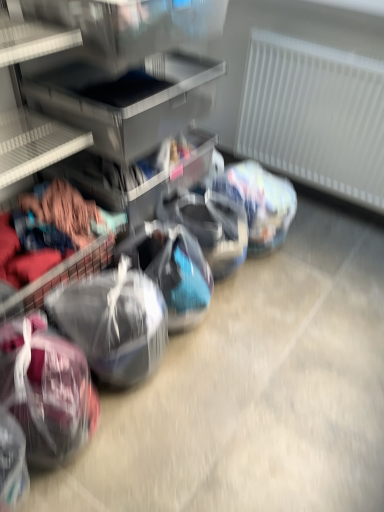
Find the location of a particular element. maroon fabric sack at lower left, which appears as the first sack when viewed from the left is located at coordinates (46, 389).

Where is `the 2nd sack to the left when counting from the white textured radiator at right`? the 2nd sack to the left when counting from the white textured radiator at right is located at coordinates (46, 389).

Which object is wider, white textured radiator at right or maroon fabric sack at lower left, the second sack when ordered from right to left?

With larger width is maroon fabric sack at lower left, the second sack when ordered from right to left.

How far apart are white textured radiator at right and maroon fabric sack at lower left, the second sack when ordered from right to left?

white textured radiator at right and maroon fabric sack at lower left, the second sack when ordered from right to left, are 1.52 meters apart.

Is white textured radiator at right oriented towards maroon fabric sack at lower left, the second sack when ordered from right to left?

Yes, white textured radiator at right is oriented towards maroon fabric sack at lower left, the second sack when ordered from right to left.

Are maroon fabric sack at lower left, the second sack when ordered from right to left, and translucent plastic sack at lower left, the 1th sack positioned from the right, located far from each other?

They are positioned close to each other.

From a real-world perspective, is maroon fabric sack at lower left, which appears as the first sack when viewed from the left, positioned above or below translucent plastic sack at lower left, the 1th sack positioned from the right?

From a real-world perspective, maroon fabric sack at lower left, which appears as the first sack when viewed from the left, is physically below translucent plastic sack at lower left, the 1th sack positioned from the right.

Considering the points (50, 360) and (161, 331), which point is behind, point (50, 360) or point (161, 331)?

The point (161, 331) is farther from the camera.

Based on the photo, would you say maroon fabric sack at lower left, the second sack when ordered from right to left, is outside translucent plastic sack at lower left, the 1th sack positioned from the right?

Yes.

Which object is wider, translucent plastic sack at lower left, the 1th sack positioned from the right, or maroon fabric sack at lower left, the second sack when ordered from right to left?

translucent plastic sack at lower left, the 1th sack positioned from the right.

Is translucent plastic sack at lower left, which is counted as the 2th sack, starting from the left, inside the boundaries of maroon fabric sack at lower left, which appears as the first sack when viewed from the left, or outside?

translucent plastic sack at lower left, which is counted as the 2th sack, starting from the left, exists outside the volume of maroon fabric sack at lower left, which appears as the first sack when viewed from the left.

Where is `sack that is under the translucent plastic sack at lower left, which is counted as the 2th sack, starting from the left (from a real-world perspective)`? The width and height of the screenshot is (384, 512). sack that is under the translucent plastic sack at lower left, which is counted as the 2th sack, starting from the left (from a real-world perspective) is located at coordinates (46, 389).

Choose the correct answer: Is white textured radiator at right inside translucent plastic sack at lower left, the 1th sack positioned from the right, or outside it?

white textured radiator at right is outside translucent plastic sack at lower left, the 1th sack positioned from the right.

Locate an element on the screen. radiator above the translucent plastic sack at lower left, the 1th sack positioned from the right (from the image's perspective) is located at coordinates (314, 116).

Between white textured radiator at right and translucent plastic sack at lower left, which is counted as the 2th sack, starting from the left, which one has more height?

With more height is white textured radiator at right.

Who is bigger, white textured radiator at right or translucent plastic sack at lower left, the 1th sack positioned from the right?

Bigger between the two is white textured radiator at right.

Visually, is maroon fabric sack at lower left, the second sack when ordered from right to left, positioned to the left or to the right of white textured radiator at right?

maroon fabric sack at lower left, the second sack when ordered from right to left, is positioned on white textured radiator at right's left side.

Does point (13, 398) come closer to viewer compared to point (275, 113)?

Yes, it is.

Is white textured radiator at right at the back of maroon fabric sack at lower left, which appears as the first sack when viewed from the left?

No.

From the image's perspective, is maroon fabric sack at lower left, which appears as the first sack when viewed from the left, above white textured radiator at right?

No, from the image's perspective, maroon fabric sack at lower left, which appears as the first sack when viewed from the left, is not over white textured radiator at right.

Can you tell me how much translucent plastic sack at lower left, which is counted as the 2th sack, starting from the left, and white textured radiator at right differ in facing direction?

translucent plastic sack at lower left, which is counted as the 2th sack, starting from the left, and white textured radiator at right are facing 89.6 degrees away from each other.

Based on their sizes in the image, would you say translucent plastic sack at lower left, the 1th sack positioned from the right, is bigger or smaller than white textured radiator at right?

Clearly, translucent plastic sack at lower left, the 1th sack positioned from the right, is smaller in size than white textured radiator at right.

From the image's perspective, is translucent plastic sack at lower left, which is counted as the 2th sack, starting from the left, located above or below white textured radiator at right?

Clearly, from the image's perspective, translucent plastic sack at lower left, which is counted as the 2th sack, starting from the left, is below white textured radiator at right.

Is translucent plastic sack at lower left, which is counted as the 2th sack, starting from the left, in contact with white textured radiator at right?

There is a gap between translucent plastic sack at lower left, which is counted as the 2th sack, starting from the left, and white textured radiator at right.

The image size is (384, 512). Identify the location of the 2nd sack to the left when counting from the white textured radiator at right. (46, 389).

This screenshot has height=512, width=384. In order to click on sack behind the maroon fabric sack at lower left, the second sack when ordered from right to left in this screenshot , I will do `click(114, 322)`.

Estimate the real-world distances between objects in this image. Which object is closer to maroon fabric sack at lower left, which appears as the first sack when viewed from the left, white textured radiator at right or translucent plastic sack at lower left, the 1th sack positioned from the right?

translucent plastic sack at lower left, the 1th sack positioned from the right, is closer to maroon fabric sack at lower left, which appears as the first sack when viewed from the left.

When comparing their distances from white textured radiator at right, does translucent plastic sack at lower left, the 1th sack positioned from the right, or maroon fabric sack at lower left, the second sack when ordered from right to left, seem closer?

translucent plastic sack at lower left, the 1th sack positioned from the right, is positioned closer to the anchor white textured radiator at right.

Considering their positions, is maroon fabric sack at lower left, the second sack when ordered from right to left, positioned closer to white textured radiator at right than translucent plastic sack at lower left, the 1th sack positioned from the right?

translucent plastic sack at lower left, the 1th sack positioned from the right, lies closer to white textured radiator at right than the other object.

Based on their spatial positions, is translucent plastic sack at lower left, the 1th sack positioned from the right, or white textured radiator at right further from maroon fabric sack at lower left, the second sack when ordered from right to left?

white textured radiator at right is positioned further to the anchor maroon fabric sack at lower left, the second sack when ordered from right to left.

Based on the photo, considering their positions, is maroon fabric sack at lower left, the second sack when ordered from right to left, positioned further to translucent plastic sack at lower left, which is counted as the 2th sack, starting from the left, than white textured radiator at right?

white textured radiator at right lies further to translucent plastic sack at lower left, which is counted as the 2th sack, starting from the left, than the other object.

Looking at the image, which one is located further to translucent plastic sack at lower left, which is counted as the 2th sack, starting from the left, white textured radiator at right or maroon fabric sack at lower left, the second sack when ordered from right to left?

Based on the image, white textured radiator at right appears to be further to translucent plastic sack at lower left, which is counted as the 2th sack, starting from the left.

The height and width of the screenshot is (512, 384). In order to click on sack between maroon fabric sack at lower left, the second sack when ordered from right to left, and white textured radiator at right in this screenshot , I will do `click(114, 322)`.